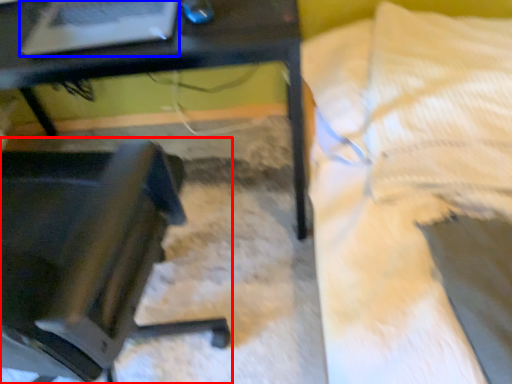
Question: Among these objects, which one is nearest to the camera, chair (highlighted by a red box) or laptop (highlighted by a blue box)?

Choices:
 (A) chair
 (B) laptop

Answer: (B)